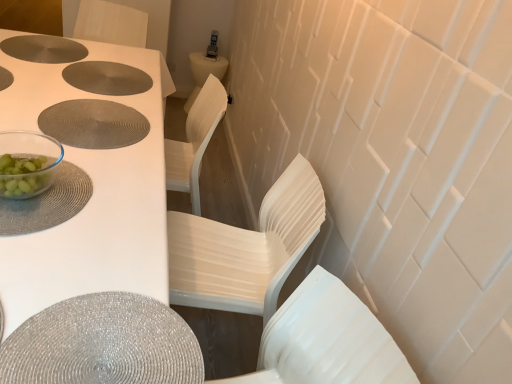
Question: Can you confirm if white plastic chair at center, the first chair positioned from the back, is shorter than white plastic chair at center, acting as the second chair starting from the back?

Choices:
 (A) yes
 (B) no

Answer: (B)

Question: Is the position of white plastic chair at center, the first chair positioned from the back, less distant than that of white plastic chair at center, acting as the second chair starting from the back?

Choices:
 (A) no
 (B) yes

Answer: (A)

Question: Is white plastic chair at center, the 2th chair viewed from the front, next to white plastic chair at center, acting as the second chair starting from the back, and touching it?

Choices:
 (A) yes
 (B) no

Answer: (B)

Question: Considering the relative sizes of white plastic chair at center, the 2th chair viewed from the front, and white plastic chair at center, the first chair viewed from the front, in the image provided, is white plastic chair at center, the 2th chair viewed from the front, smaller than white plastic chair at center, the first chair viewed from the front,?

Choices:
 (A) yes
 (B) no

Answer: (B)

Question: Can you confirm if white plastic chair at center, the first chair positioned from the back, is positioned to the left of white plastic chair at center, the first chair viewed from the front?

Choices:
 (A) yes
 (B) no

Answer: (A)

Question: In terms of height, does white plastic chair at center, the first chair viewed from the front, look taller or shorter compared to white glossy table at upper left?

Choices:
 (A) tall
 (B) short

Answer: (B)

Question: From a real-world perspective, relative to white glossy table at upper left, is white plastic chair at center, acting as the second chair starting from the back, vertically above or below?

Choices:
 (A) above
 (B) below

Answer: (A)

Question: Visually, is white plastic chair at center, acting as the second chair starting from the back, positioned to the left or to the right of white glossy table at upper left?

Choices:
 (A) left
 (B) right

Answer: (B)

Question: Considering the positions of white plastic chair at center, acting as the second chair starting from the back, and white glossy table at upper left in the image, is white plastic chair at center, acting as the second chair starting from the back, wider or thinner than white glossy table at upper left?

Choices:
 (A) thin
 (B) wide

Answer: (A)

Question: From a real-world perspective, relative to matte silver placemat at center, the third hole positioned from the top, is white plastic chair at center, the first chair positioned from the back, vertically above or below?

Choices:
 (A) below
 (B) above

Answer: (A)

Question: Does point (x=189, y=228) appear closer or farther from the camera than point (x=100, y=105)?

Choices:
 (A) farther
 (B) closer

Answer: (A)

Question: Which is correct: white plastic chair at center, the 2th chair viewed from the front, is inside matte silver placemat at center, the third hole positioned from the top, or outside of it?

Choices:
 (A) outside
 (B) inside

Answer: (A)

Question: Looking at their shapes, would you say white plastic chair at center, the first chair positioned from the back, is wider or thinner than matte silver placemat at center, which ranks as the first hole in bottom-to-top order?

Choices:
 (A) thin
 (B) wide

Answer: (B)

Question: In terms of size, does shiny silver placemat at lower left appear bigger or smaller than matte gray placemat at upper left, which is counted as the second hole, starting from the top?

Choices:
 (A) small
 (B) big

Answer: (B)

Question: Do you think shiny silver placemat at lower left is within matte gray placemat at upper left, which is counted as the second hole, starting from the top, or outside of it?

Choices:
 (A) outside
 (B) inside

Answer: (A)